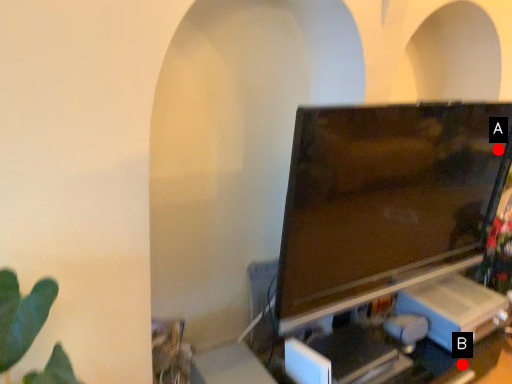
Question: Two points are circled on the image, labeled by A and B beside each circle. Which point is closer to the camera taking this photo?

Choices:
 (A) A is closer
 (B) B is closer

Answer: (A)